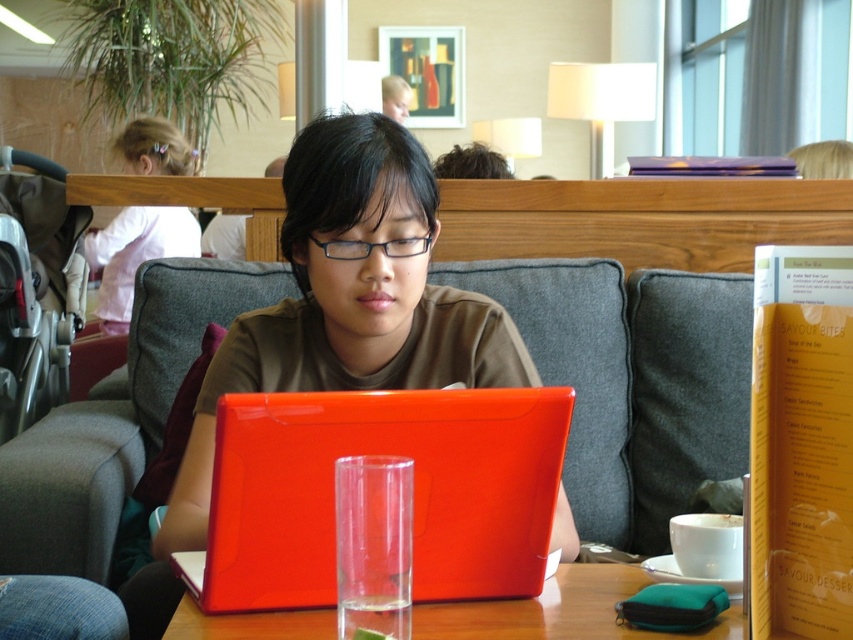
Between matte plastic laptop at center and transparent glass at center, which one appears on the left side from the viewer's perspective?

matte plastic laptop at center

Can you confirm if matte plastic laptop at center is positioned to the right of transparent glass at center?

In fact, matte plastic laptop at center is to the left of transparent glass at center.

Locate an element on the screen. matte plastic laptop at center is located at coordinates (338, 316).

Is glossy plastic laptop at center shorter than black plastic glasses at center?

No, glossy plastic laptop at center is not shorter than black plastic glasses at center.

Can you confirm if glossy plastic laptop at center is bigger than black plastic glasses at center?

Yes, glossy plastic laptop at center is bigger than black plastic glasses at center.

The width and height of the screenshot is (853, 640). What are the coordinates of `glossy plastic laptop at center` in the screenshot? It's located at click(413, 490).

Which is in front, point (282, 496) or point (403, 605)?

Point (403, 605)

Does glossy plastic laptop at center have a lesser height compared to transparent glass at center?

In fact, glossy plastic laptop at center may be taller than transparent glass at center.

Which is behind, point (277, 499) or point (358, 516)?

Positioned behind is point (277, 499).

The width and height of the screenshot is (853, 640). What are the coordinates of `glossy plastic laptop at center` in the screenshot? It's located at (413, 490).